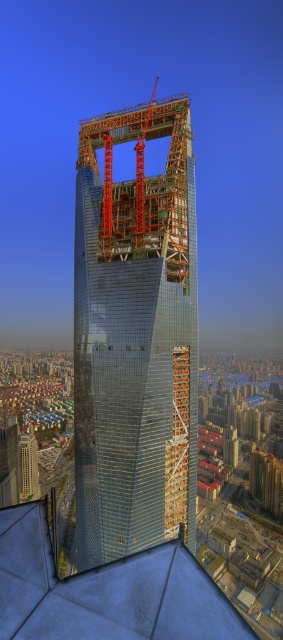
Does transparent glass tower at center have a lesser height compared to orange metallic crane at upper center?

No, transparent glass tower at center is not shorter than orange metallic crane at upper center.

Measure the distance between point (88, 348) and camera.

Point (88, 348) is 282.12 meters away from camera.

The image size is (283, 640). Identify the location of transparent glass tower at center. (134, 337).